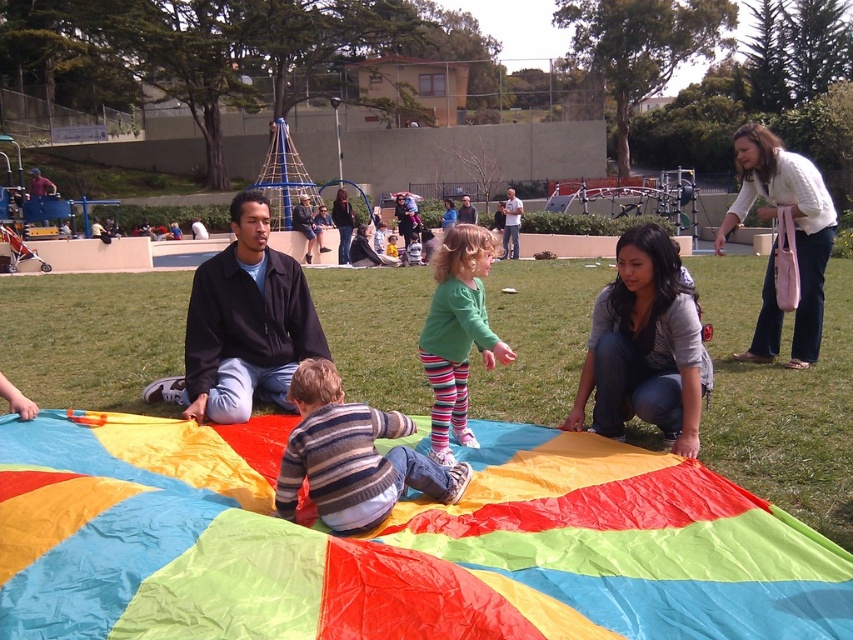
You are a photographer positioned at the edge of the grassy field. You want to take a photo of the green fabric parachute at center without the white sweater at upper right appearing in the foreground. Is this possible given their positions?

The white sweater at upper right is further to the viewer than the green fabric parachute at center, so it will appear in the foreground. To avoid capturing the white sweater at upper right in the photo, you would need to adjust your position or angle to ensure it is not blocking the view of the green fabric parachute at center.

You are an observer at the park and notice two items in the scene. The first is the white sweater at upper right and the second is the green fabric parachute at center. Which item is larger in size?

The white sweater at upper right is bigger than the green fabric parachute at center.

What object is located at the coordinate point [643,346] in the scene?

The point [643,346] is located on the gray cotton shirt at center.